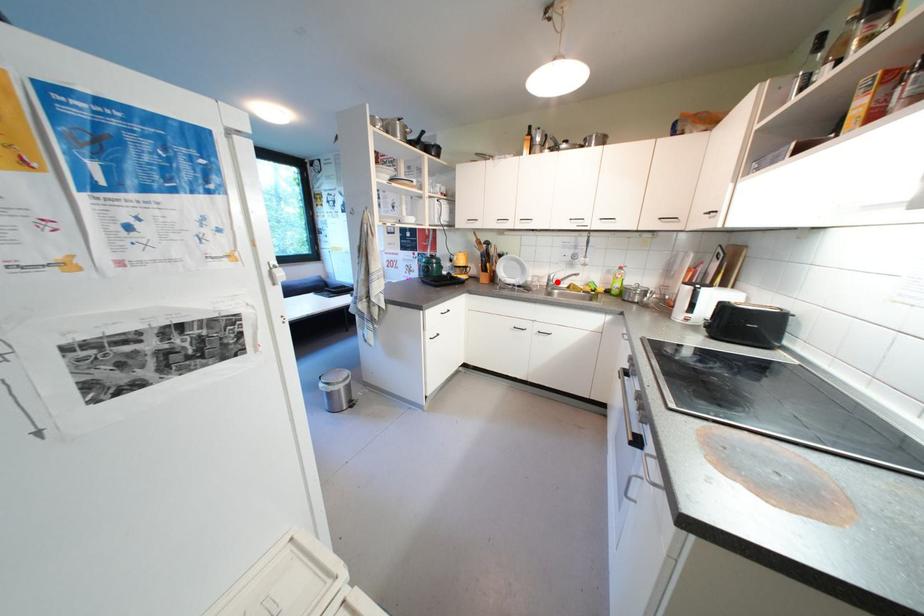
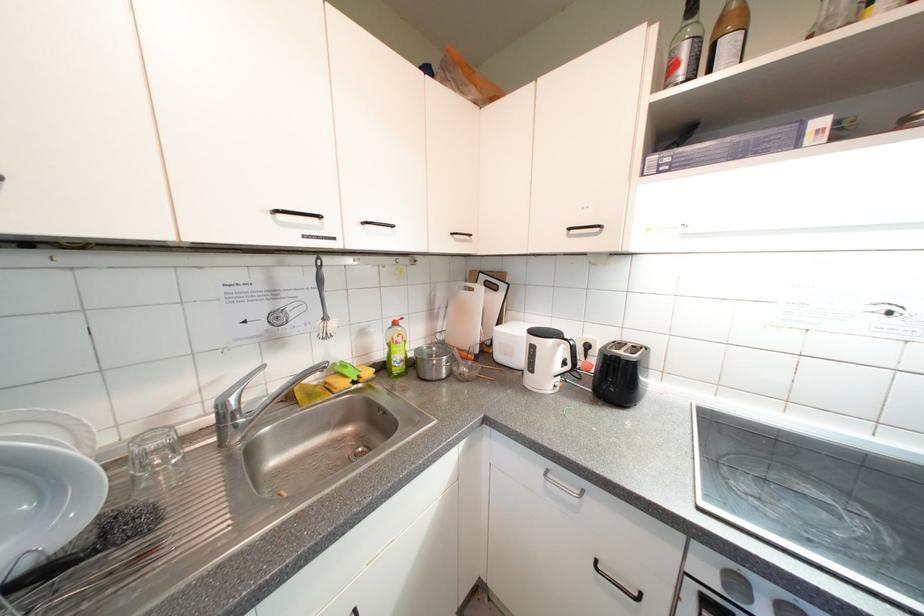
In the second image, find the point that corresponds to the highlighted location in the first image.

(233, 419)